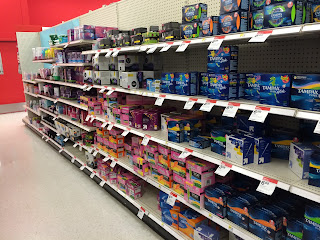
Identify the location of red wall. The height and width of the screenshot is (240, 320). (10, 91), (36, 11).